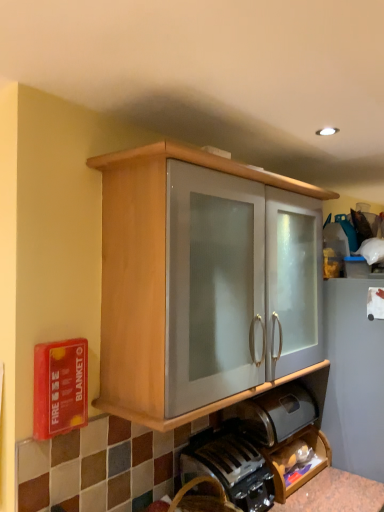
Question: Is wooden shelf at lower right further to camera compared to wooden cabinet at center?

Choices:
 (A) yes
 (B) no

Answer: (A)

Question: From a real-world perspective, is wooden shelf at lower right physically above wooden cabinet at center?

Choices:
 (A) yes
 (B) no

Answer: (B)

Question: Does wooden shelf at lower right have a lesser width compared to wooden cabinet at center?

Choices:
 (A) yes
 (B) no

Answer: (A)

Question: From a real-world perspective, is wooden shelf at lower right located beneath wooden cabinet at center?

Choices:
 (A) yes
 (B) no

Answer: (A)

Question: Is wooden shelf at lower right turned away from wooden cabinet at center?

Choices:
 (A) yes
 (B) no

Answer: (B)

Question: Does wooden shelf at lower right appear on the right side of wooden cabinet at center?

Choices:
 (A) no
 (B) yes

Answer: (B)

Question: Is black plastic coffee machine at lower center positioned in front of wooden shelf at lower right?

Choices:
 (A) yes
 (B) no

Answer: (A)

Question: Is black plastic coffee machine at lower center surrounding wooden shelf at lower right?

Choices:
 (A) yes
 (B) no

Answer: (B)

Question: From the image's perspective, is black plastic coffee machine at lower center on wooden shelf at lower right?

Choices:
 (A) no
 (B) yes

Answer: (B)

Question: Could you tell me if black plastic coffee machine at lower center is turned towards wooden shelf at lower right?

Choices:
 (A) no
 (B) yes

Answer: (A)

Question: Does black plastic coffee machine at lower center appear on the right side of wooden shelf at lower right?

Choices:
 (A) no
 (B) yes

Answer: (A)

Question: Is black plastic coffee machine at lower center wider than wooden shelf at lower right?

Choices:
 (A) no
 (B) yes

Answer: (B)

Question: Is black plastic coffee machine at lower center in contact with wooden cabinet at center?

Choices:
 (A) no
 (B) yes

Answer: (A)